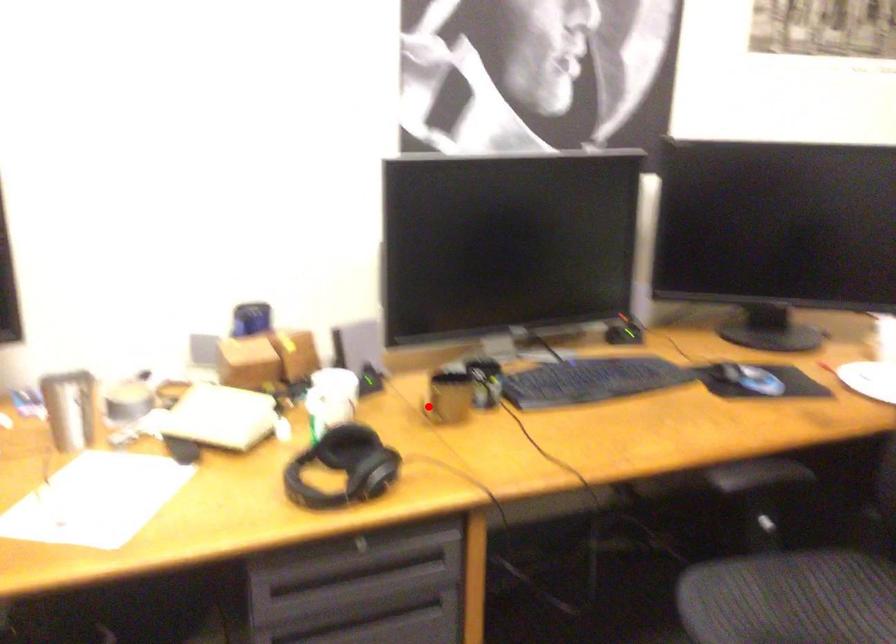
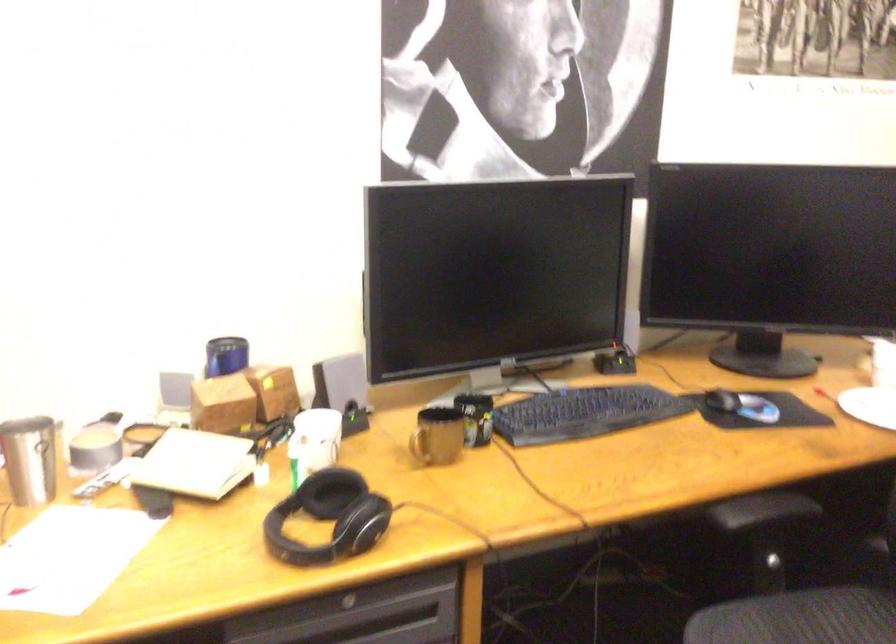
Locate, in the second image, the point that corresponds to the highlighted location in the first image.

(419, 446)